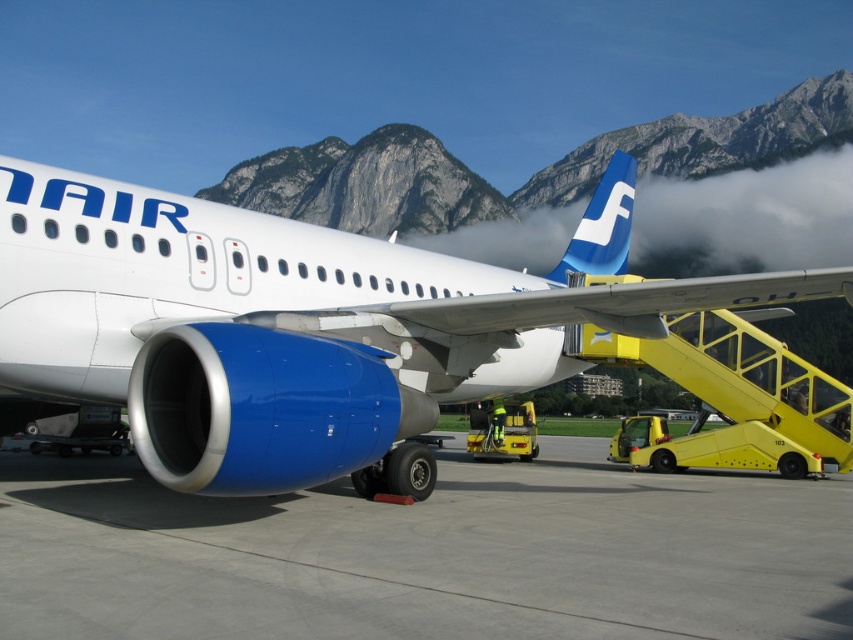
Question: Can you confirm if blue metallic airplane at center is positioned above blue matte tail at upper center?

Choices:
 (A) no
 (B) yes

Answer: (A)

Question: Can you confirm if blue metallic airplane at center is positioned above blue matte tail at upper center?

Choices:
 (A) yes
 (B) no

Answer: (B)

Question: Does gray concrete tarmac at lower center have a smaller size compared to blue matte tail at upper center?

Choices:
 (A) yes
 (B) no

Answer: (A)

Question: Which of the following is the farthest from the observer?

Choices:
 (A) blue matte tail at upper center
 (B) blue metallic airplane at center
 (C) gray concrete tarmac at lower center

Answer: (A)

Question: Which of the following is the closest to the observer?

Choices:
 (A) (318, 582)
 (B) (596, 273)
 (C) (433, 392)

Answer: (A)

Question: Which of the following is the closest to the observer?

Choices:
 (A) [x=627, y=154]
 (B) [x=260, y=310]

Answer: (B)